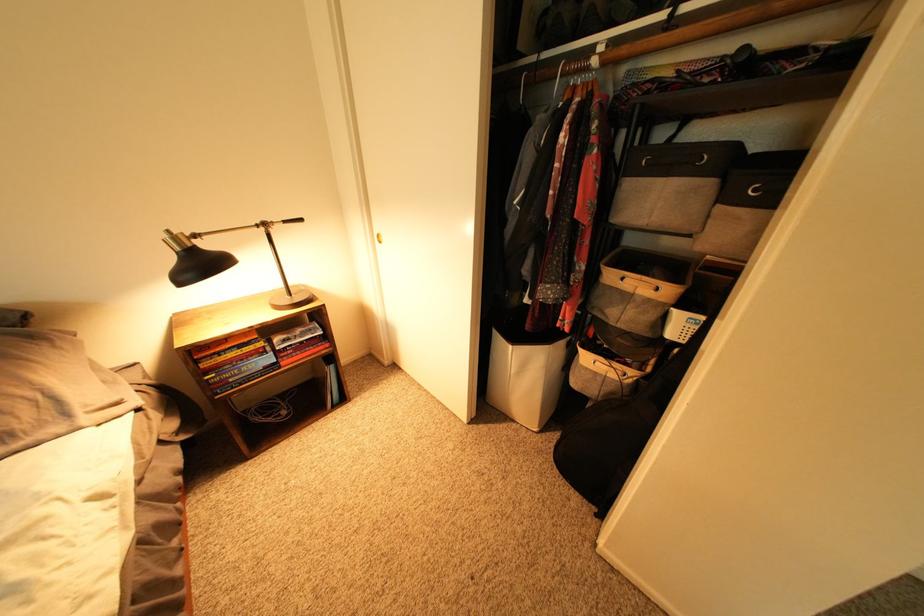
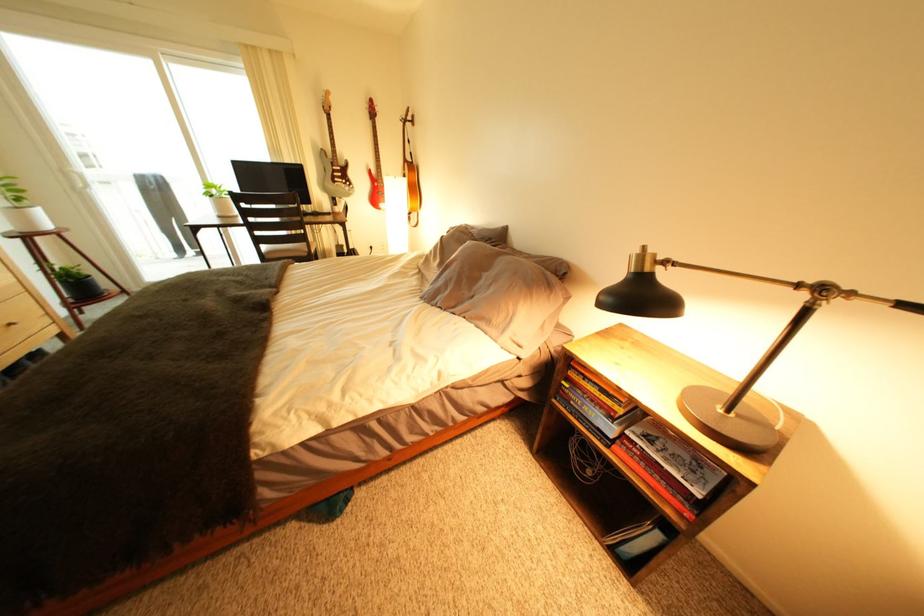
The point at (177, 237) is marked in the first image. Where is the corresponding point in the second image?

(650, 253)